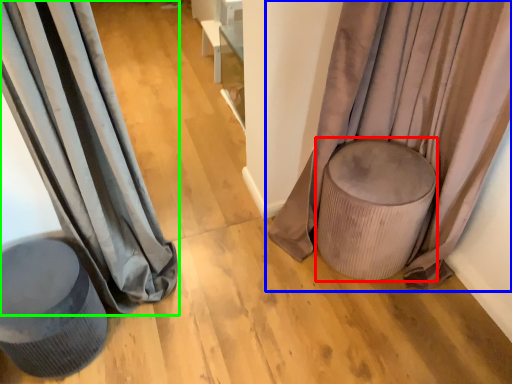
Question: Which object is the closest to the music stool (highlighted by a red box)? Choose among these: curtain (highlighted by a blue box) or curtain (highlighted by a green box).

Choices:
 (A) curtain
 (B) curtain

Answer: (A)